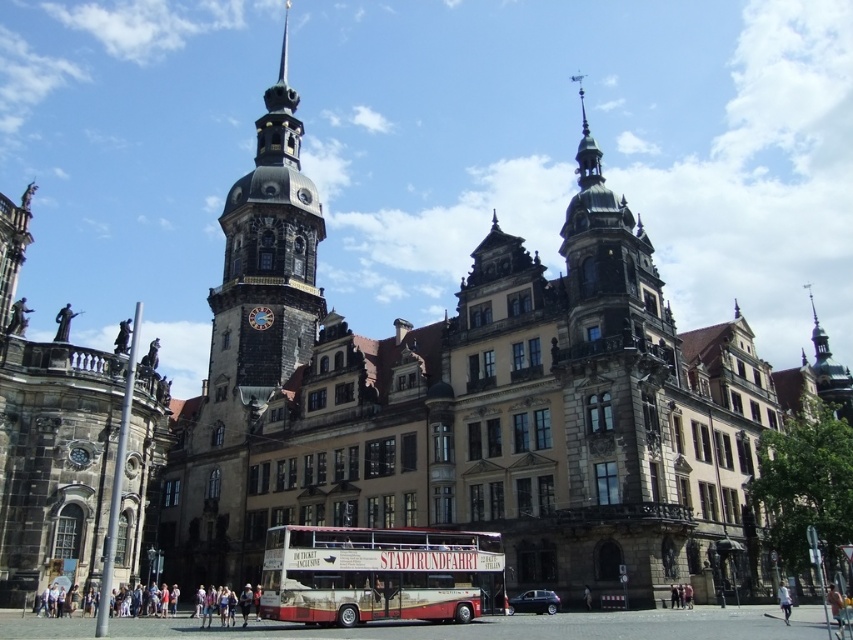
Can you confirm if dark gray stone tower at upper center is bigger than red painted wood decker bus at center?

Correct, dark gray stone tower at upper center is larger in size than red painted wood decker bus at center.

Between dark gray stone tower at upper center and red painted wood decker bus at center, which one appears on the right side from the viewer's perspective?

From the viewer's perspective, red painted wood decker bus at center appears more on the right side.

This screenshot has width=853, height=640. Find the location of `dark gray stone tower at upper center`. dark gray stone tower at upper center is located at coordinates (267, 259).